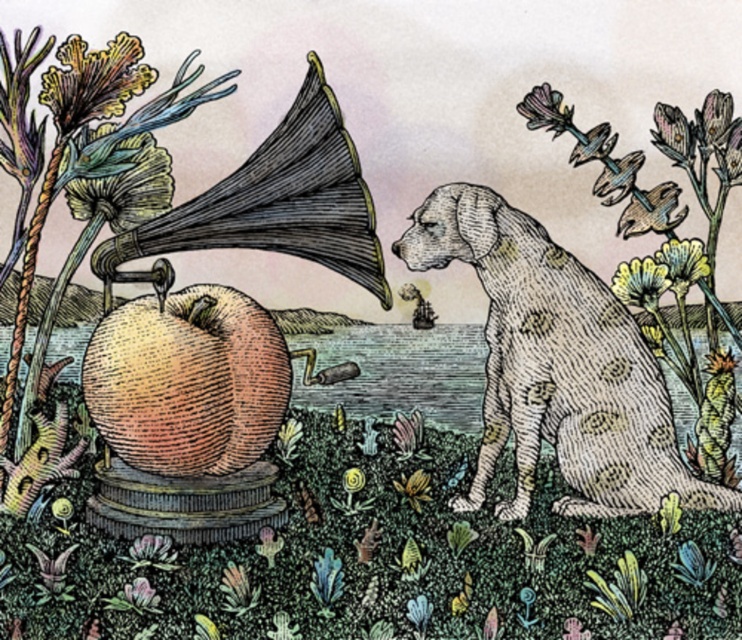
Consider the image. Is speckled fur dog at right thinner than yellow textured petals at upper right?

Incorrect, speckled fur dog at right's width is not less than yellow textured petals at upper right's.

Between point (459, 184) and point (631, 296), which one is positioned behind?

Positioned behind is point (631, 296).

Who is more distant from viewer, (565, 314) or (640, 278)?

Positioned behind is point (640, 278).

Image resolution: width=742 pixels, height=640 pixels. I want to click on speckled fur dog at right, so click(556, 365).

Can you confirm if speckled fur dog at right is smaller than pastel yellow petals at upper right?

No.

Does speckled fur dog at right appear over pastel yellow petals at upper right?

Actually, speckled fur dog at right is below pastel yellow petals at upper right.

Who is more forward, (x=581, y=300) or (x=663, y=260)?

Positioned in front is point (x=581, y=300).

Where is `speckled fur dog at right`? The image size is (742, 640). speckled fur dog at right is located at coordinates (556, 365).

Is matte yellow-green leaf at upper left closer to the viewer compared to matte yellow flower at upper right?

That is True.

Is point (116, 65) behind point (692, 157)?

No, (116, 65) is closer to viewer.

Identify the location of matte yellow-green leaf at upper left. This screenshot has width=742, height=640. (93, 81).